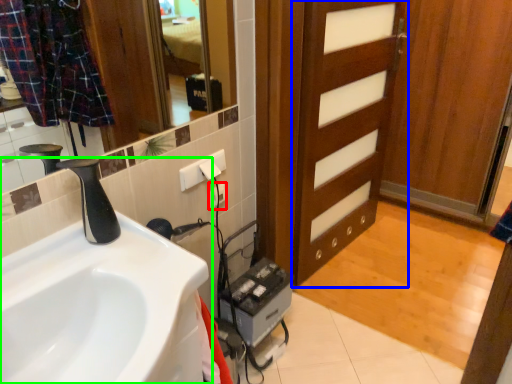
Question: Considering the real-world distances, which object is closest to electric outlet (highlighted by a red box)? door (highlighted by a blue box) or sink (highlighted by a green box).

Choices:
 (A) door
 (B) sink

Answer: (B)